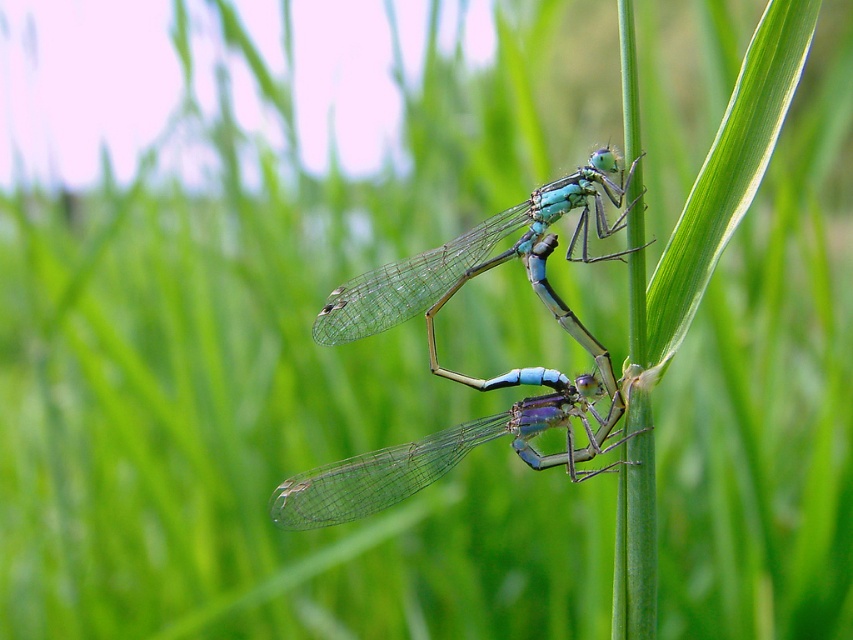
You are an entomologist observing two dragonflies perched on a stem. You notice that one is a real translucent blue dragonfly at center and the other is a translucent glass dragonfly at center. Which one is shorter in height?

The translucent blue dragonfly at center is not as tall as the translucent glass dragonfly at center, so the real dragonfly is shorter.

You are a photographer aiming to capture the translucent blue dragonfly at center. Given that your camera focuses on the point at coordinates point (453, 452), will the dragonfly be in focus?

The translucent blue dragonfly at center is represented by point (453, 452), so yes, the dragonfly will be in focus since the camera is focusing on that exact point.